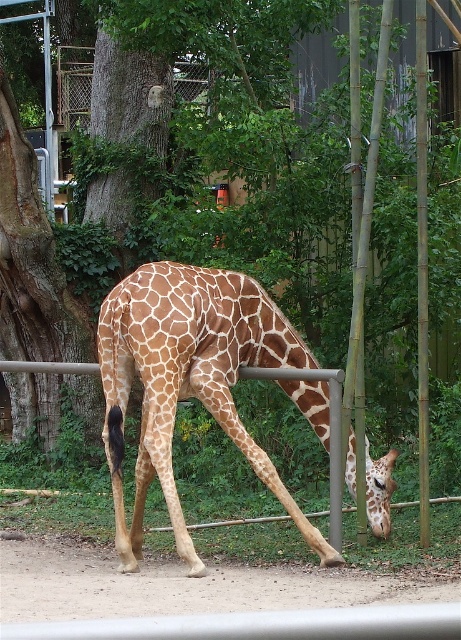
You are a visitor at the zoo and want to take a photo of the brown spotted giraffe at center and the brown textured tree at center. Which one do you need to focus on first to ensure both are in sharp focus?

The brown spotted giraffe at center is closer to the viewer than the brown textured tree at center, so you should focus on the brown spotted giraffe at center first to ensure both are in sharp focus.

You are a zookeeper standing at the entrance of the giraffe enclosure. You need to place a new feeding station between the giraffe and the brown textured tree at center. The feeding station requires a minimum of 5 meters of space to be placed safely. Can you determine if there is enough space between them?

The distance between the giraffe and the brown textured tree at center is not provided in the scene description. However, the brown textured tree at center is 10.84 meters away from the viewer. Without knowing the giraffe distance from the viewer, we cannot determine the space between them. Please check the distance between the giraffe and the tree first.